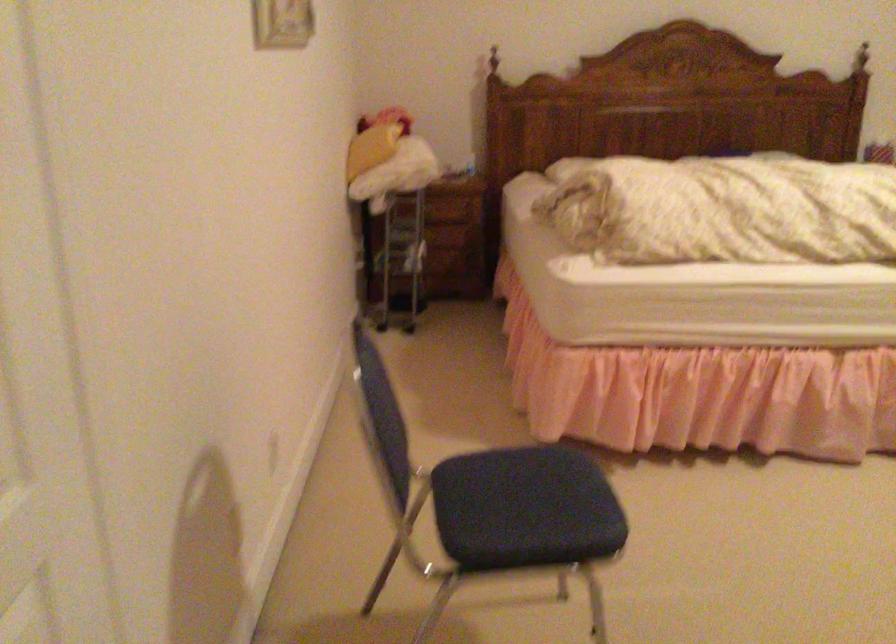
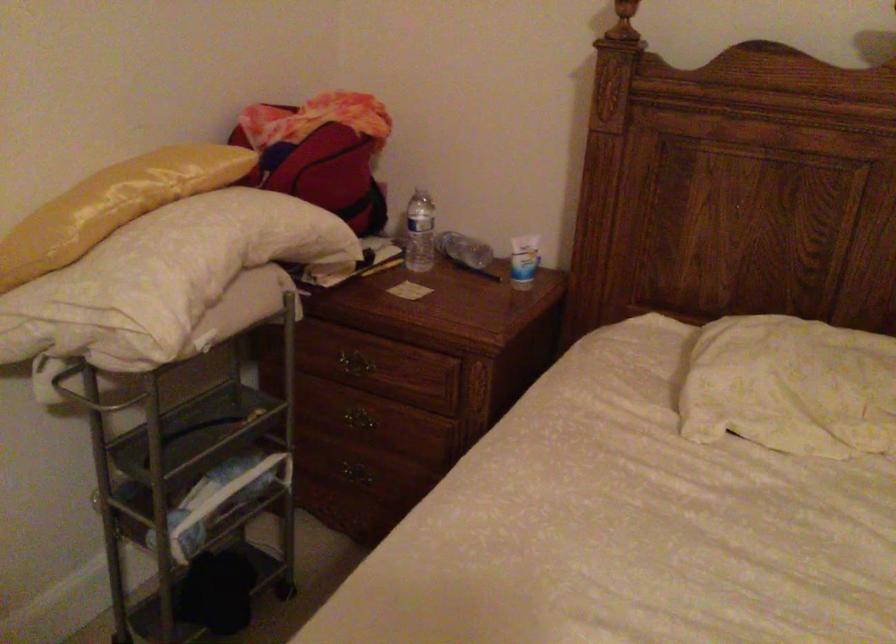
Find the pixel in the second image that matches (405,192) in the first image.

(91, 393)